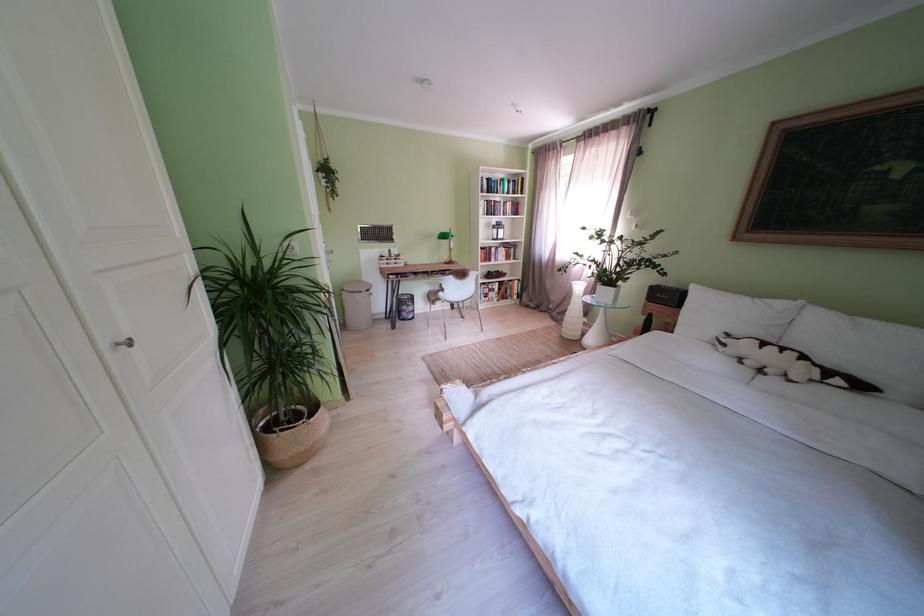
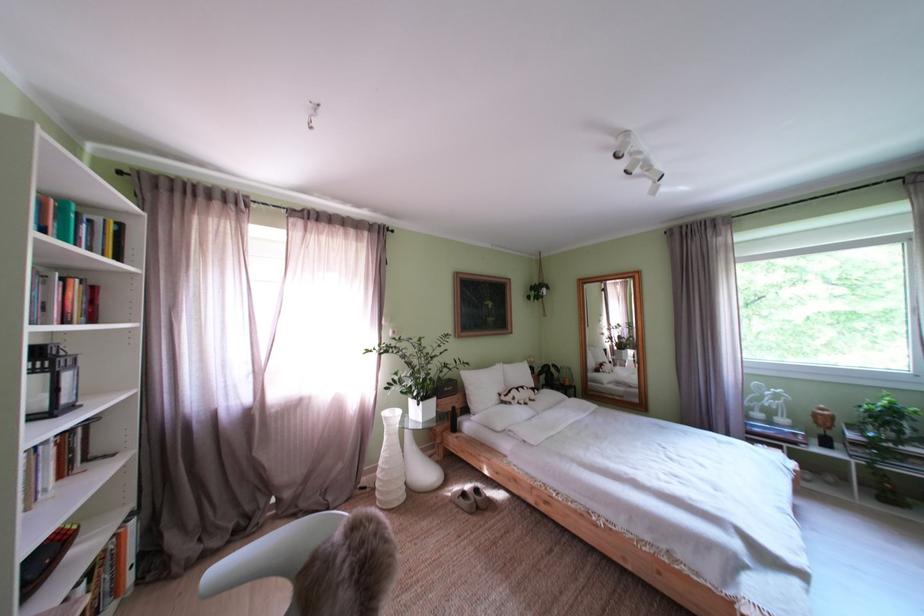
Find the pixel in the second image that matches (x=735, y=350) in the first image.

(525, 405)